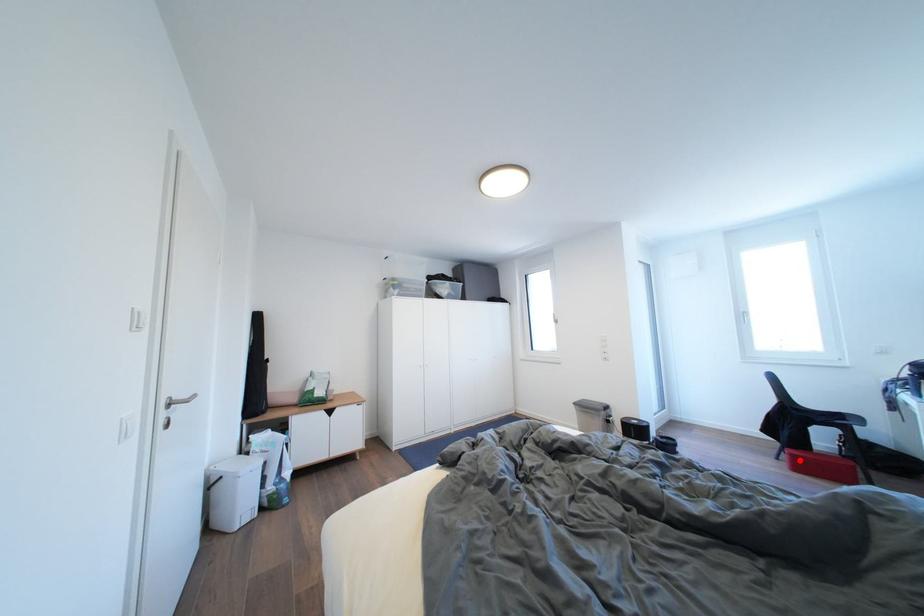
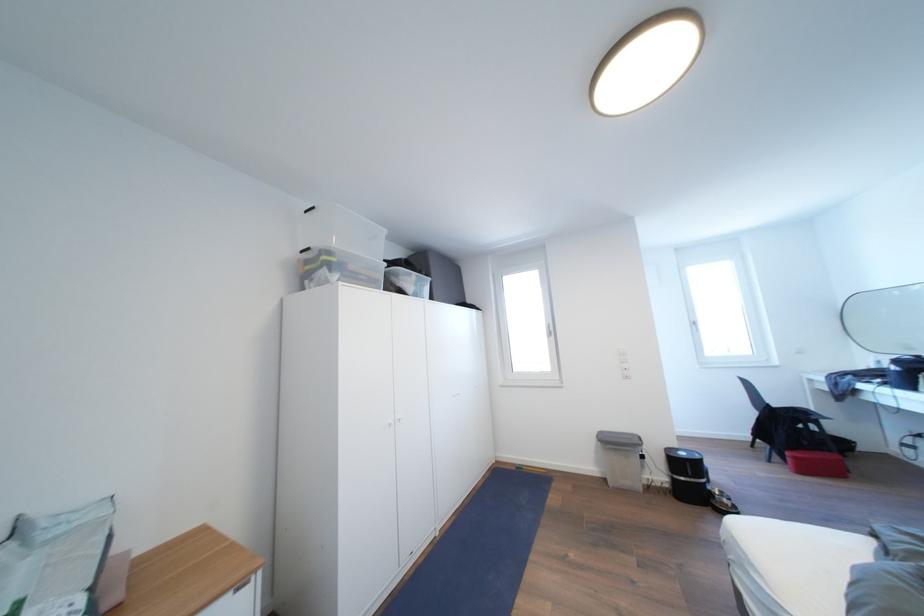
Find the pixel in the second image that matches the highlighted location in the first image.

(803, 463)